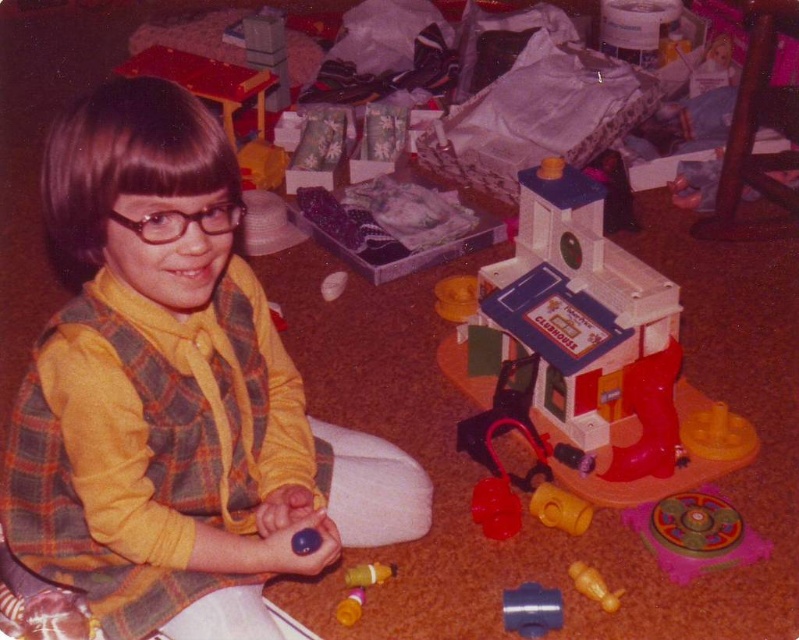
Question: Can you confirm if yellow plaid vest at center is bigger than pink plastic toy at lower right?

Choices:
 (A) yes
 (B) no

Answer: (A)

Question: Can you confirm if translucent plastic toy at center is bigger than glossy plastic ball at lower center?

Choices:
 (A) no
 (B) yes

Answer: (B)

Question: Which object is the closest to the blue matte pipe at center?

Choices:
 (A) yellow plastic toy at lower center
 (B) yellow plaid vest at center

Answer: (A)

Question: Which point is farther to the camera?

Choices:
 (A) (382, 580)
 (B) (619, 600)
 (C) (317, 531)
 (D) (642, 515)

Answer: (D)

Question: Which point is farther to the camera?

Choices:
 (A) (591, 576)
 (B) (535, 588)
 (C) (585, 529)

Answer: (C)

Question: Does blue matte pipe at center have a greater width compared to yellow plastic toy at lower center?

Choices:
 (A) no
 (B) yes

Answer: (A)